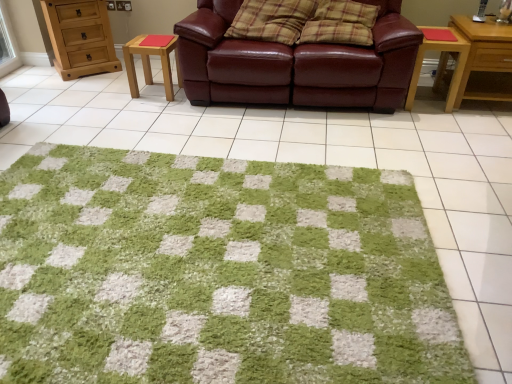
The width and height of the screenshot is (512, 384). Identify the location of free space in front of leather couch at center. (328, 140).